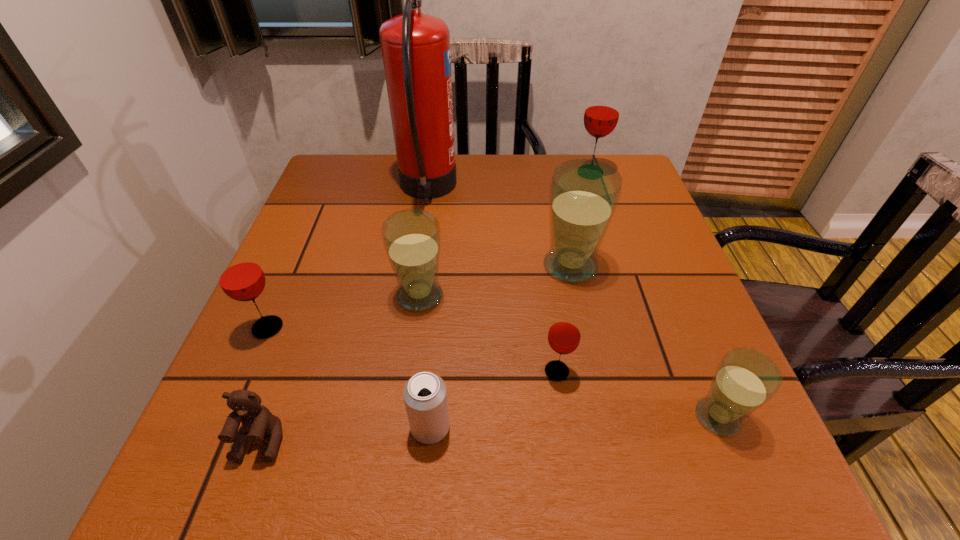
Find the location of `the second nearest glass`. the second nearest glass is located at coordinates (564, 335).

I want to click on the smallest blue glass, so click(x=745, y=379).

What are the coordinates of `the nearest blue glass` in the screenshot? It's located at (745, 379).

Where is `white beer can`? This screenshot has height=540, width=960. white beer can is located at coordinates (425, 396).

This screenshot has width=960, height=540. I want to click on teddy bear, so click(x=257, y=421).

This screenshot has width=960, height=540. Identify the location of free space located on the surface of the red fire extinguisher. (600, 191).

Image resolution: width=960 pixels, height=540 pixels. I want to click on free spot located on the left of the farthest red glass, so click(506, 173).

Identify the location of vacant space located 0.130m on the left of the biggest blue glass. The width and height of the screenshot is (960, 540). (480, 266).

Identify the location of free location located on the back of the second glass from left to right. The image size is (960, 540). (429, 225).

Where is `free space located on the right of the leftmost red glass`? free space located on the right of the leftmost red glass is located at coordinates (439, 328).